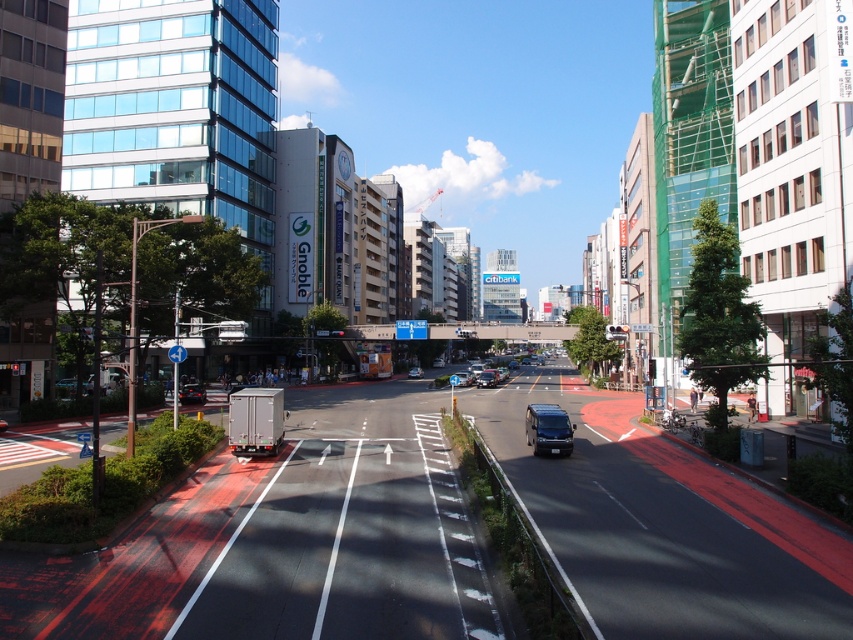
Question: Which object is the closest to the matte black van at center?

Choices:
 (A) shiny black car at lower left
 (B) metallic silver van at center

Answer: (A)

Question: In this image, where is shiny black car at lower left located relative to matte black van at center?

Choices:
 (A) left
 (B) right

Answer: (A)

Question: Estimate the real-world distances between objects in this image. Which object is closer to the silver metallic sedan at center?

Choices:
 (A) shiny black car at lower left
 (B) matte black van at center

Answer: (B)

Question: Which of these objects is positioned closest to the silver metallic sedan at center?

Choices:
 (A) shiny black car at lower left
 (B) matte black van at center

Answer: (B)

Question: Does metallic silver van at center have a lesser width compared to shiny black car at lower left?

Choices:
 (A) yes
 (B) no

Answer: (A)

Question: Is shiny black car at lower left smaller than matte black van at center?

Choices:
 (A) no
 (B) yes

Answer: (B)